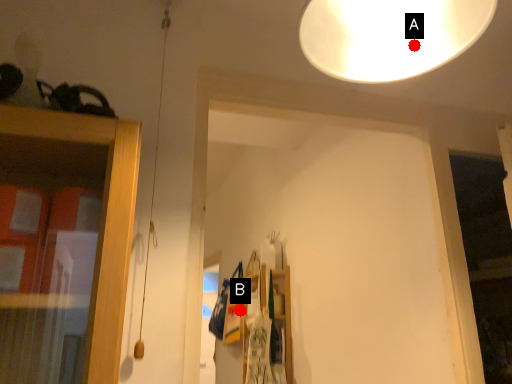
Question: Two points are circled on the image, labeled by A and B beside each circle. Which point appears closest to the camera in this image?

Choices:
 (A) A is closer
 (B) B is closer

Answer: (A)